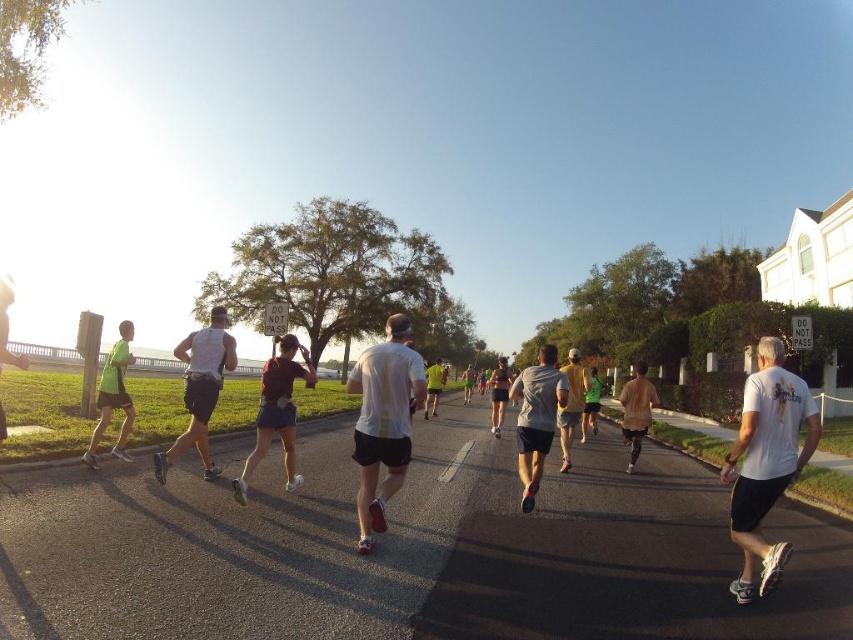
Question: Which object appears farthest from the camera in this image?

Choices:
 (A) yellow fabric shirt at center
 (B) white matte shorts at center

Answer: (A)

Question: Does white matte shorts at center have a larger size compared to gray matte shirt at center?

Choices:
 (A) no
 (B) yes

Answer: (B)

Question: Considering the relative positions of white matte shirt at center and yellow fabric shirt at center in the image provided, where is white matte shirt at center located with respect to yellow fabric shirt at center?

Choices:
 (A) above
 (B) below

Answer: (B)

Question: Among these objects, which one is farthest from the camera?

Choices:
 (A) white matte shirt at center
 (B) gray matte shirt at center
 (C) white matte shorts at center

Answer: (B)

Question: Which point is closer to the camera?

Choices:
 (A) matte pink shorts at center
 (B) white matte shorts at center

Answer: (A)

Question: Can you confirm if matte pink shorts at center is positioned to the left of yellow fabric shirt at center?

Choices:
 (A) no
 (B) yes

Answer: (B)